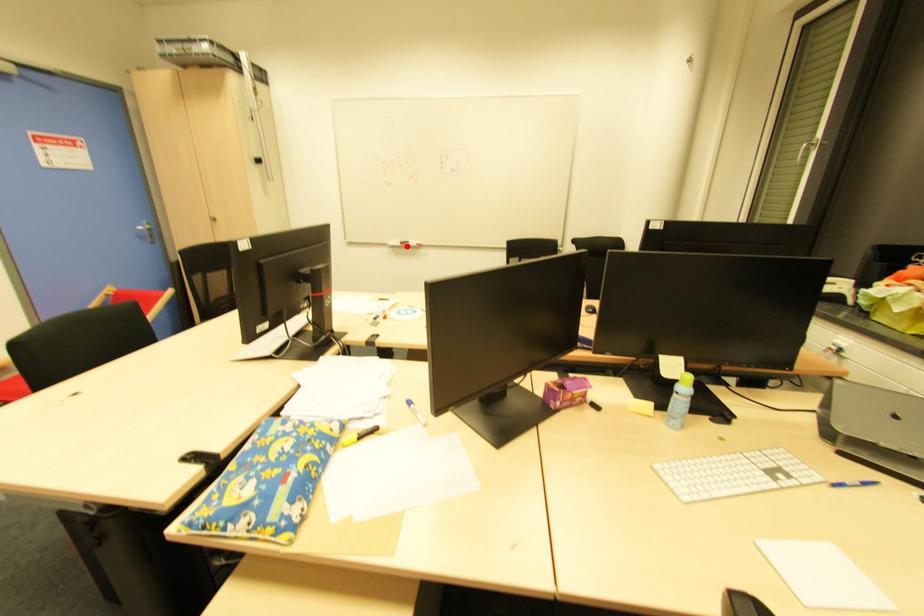
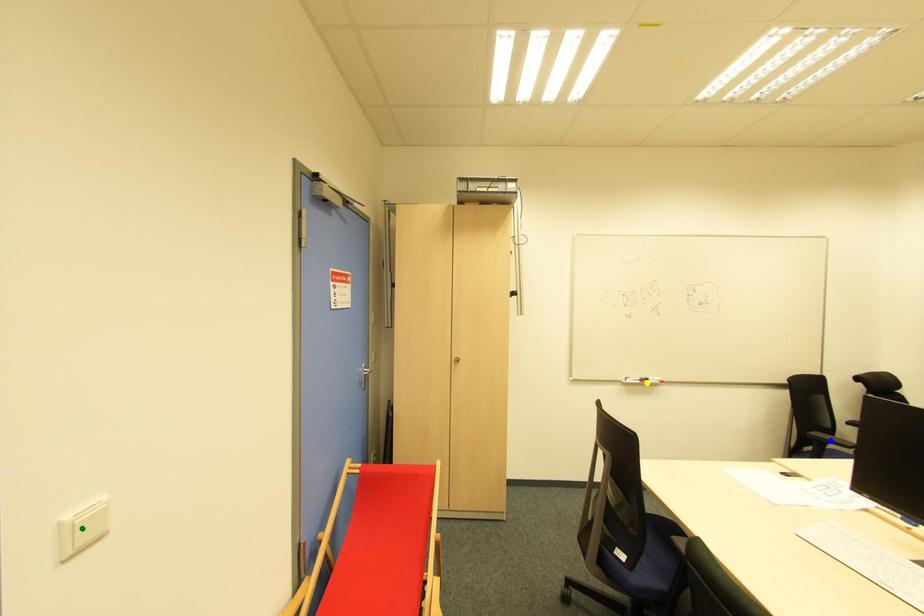
Question: I am providing you with two images of the same scene from different viewpoints. A red point is marked on the first image. You are given multiple points on the second image. Which point in image 2 is actually the same real-world point as the red point in image 1?

Choices:
 (A) green point
 (B) yellow point
 (C) blue point

Answer: (B)